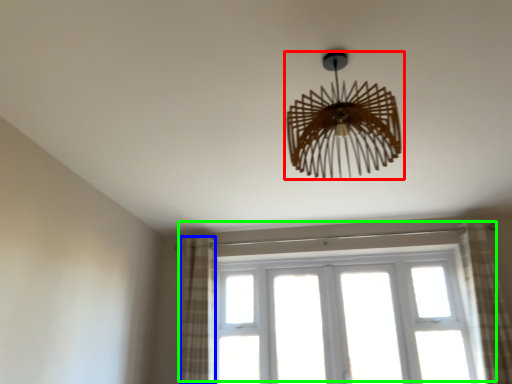
Question: Which object is positioned closest to lamp (highlighted by a red box)? Select from curtain (highlighted by a blue box) and window (highlighted by a green box).

Choices:
 (A) curtain
 (B) window

Answer: (A)